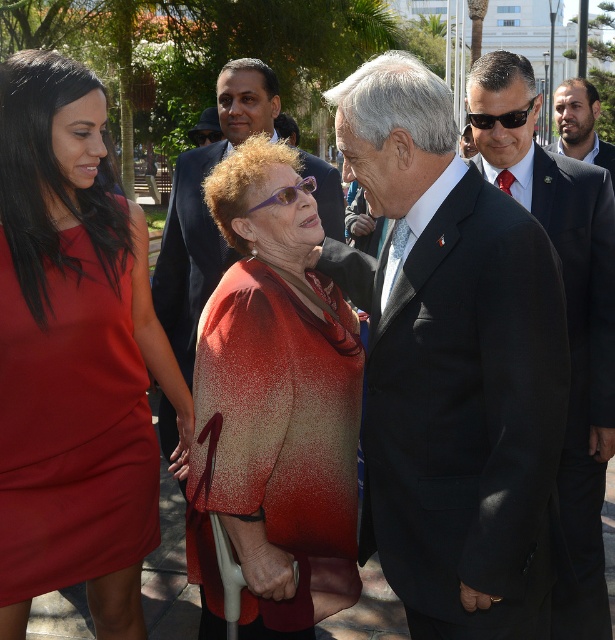
Question: Which point appears closest to the camera in this image?

Choices:
 (A) (590, 163)
 (B) (590, 108)
 (C) (563, 488)
 (D) (512, 426)

Answer: (D)

Question: Which object is closer to the camera taking this photo?

Choices:
 (A) black wool suit at upper right
 (B) black suit at center
 (C) matte red dress at center

Answer: (B)

Question: Does black suit at center have a smaller size compared to black wool suit at upper right?

Choices:
 (A) no
 (B) yes

Answer: (A)

Question: Among these points, which one is farthest from the camera?

Choices:
 (A) (276, 305)
 (B) (595, 164)
 (C) (579, 115)
 (D) (89, 381)

Answer: (C)

Question: Does speckled red coat at center have a smaller size compared to black wool suit at upper right?

Choices:
 (A) yes
 (B) no

Answer: (B)

Question: Can you confirm if speckled red coat at center is smaller than black suit at center?

Choices:
 (A) no
 (B) yes

Answer: (B)